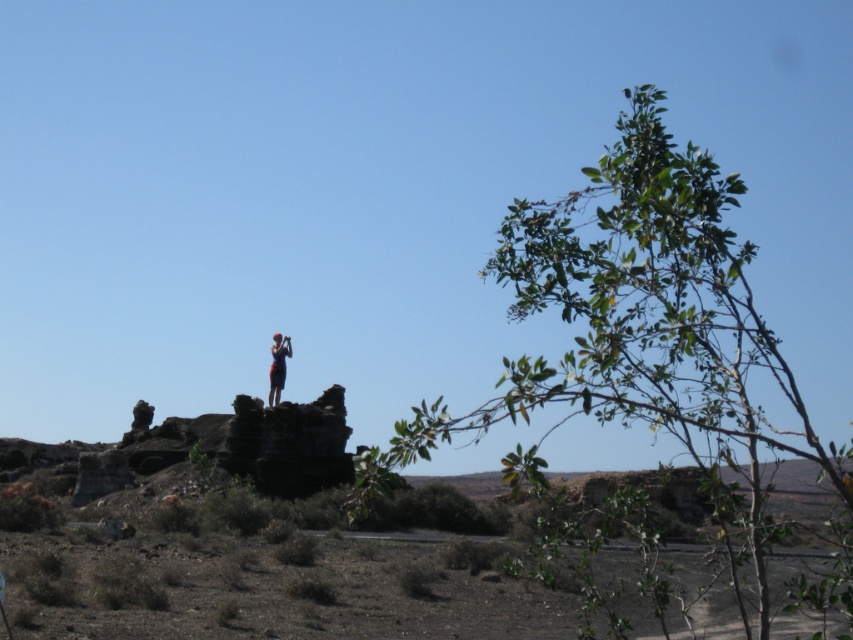
Does green leafy tree at upper right appear over red fabric person at center?

No.

Is point (749, 417) less distant than point (277, 384)?

Yes, it is in front of point (277, 384).

Which is behind, point (397, 449) or point (271, 349)?

The point (271, 349) is more distant.

Identify the location of green leafy tree at upper right. (648, 326).